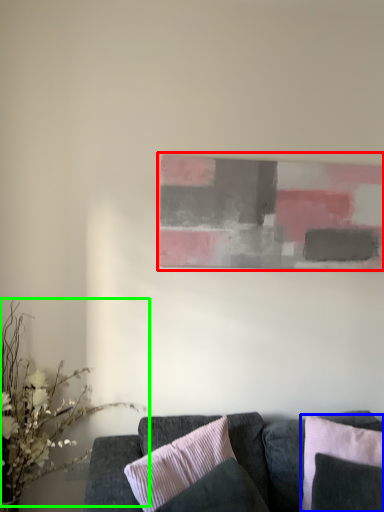
Question: Which object is positioned farthest from picture frame (highlighted by a red box)? Select from pillow (highlighted by a blue box) and floral arrangement (highlighted by a green box).

Choices:
 (A) pillow
 (B) floral arrangement

Answer: (B)